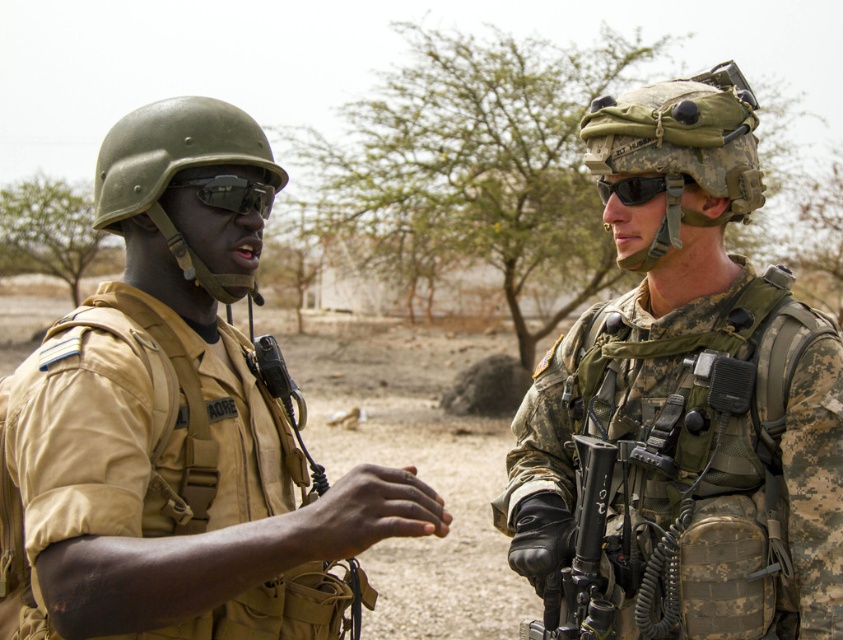
You are a military equipment inspector. You need to determine if the matte khaki uniform at center can be stored in a standard storage container designed for the matte black goggles at center. Based on their sizes, what is your conclusion?

The matte khaki uniform at center is wider than the matte black goggles at center. Since the uniform is larger in width, it cannot be stored in the standard container designed for the matte black goggles at center.

You are a drone operator controlling a drone with a 1.5 meter wingspan. You need to fly the drone between the matte khaki uniform at center and the matte black goggles at center. Is there enough space for the drone to pass through?

The distance between the matte khaki uniform at center and the matte black goggles at center is 1.44 meters. Since the drone has a wingspan of 1.5 meters, it is slightly too wide to pass through the space between them. The drone cannot fit through the gap.

Based on the scene description, which object is taller between the matte khaki uniform at center and the matte black goggles at center?

The matte khaki uniform at center is much taller than the matte black goggles at center according to the description.